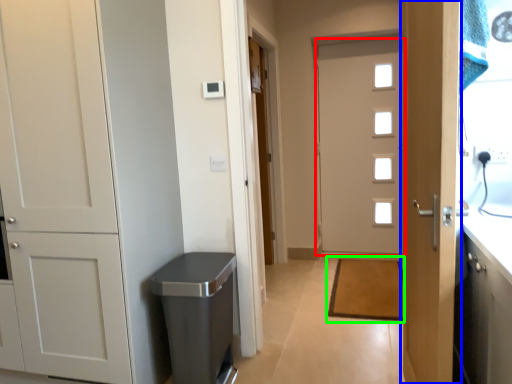
Question: Considering the real-world distances, which object is closest to door (highlighted by a red box)? door (highlighted by a blue box) or doormat (highlighted by a green box).

Choices:
 (A) door
 (B) doormat

Answer: (B)